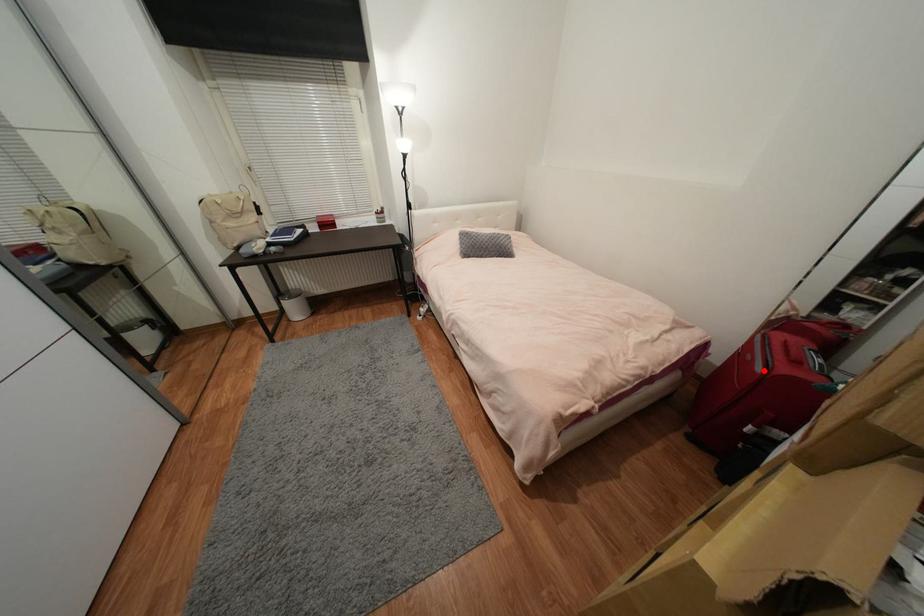
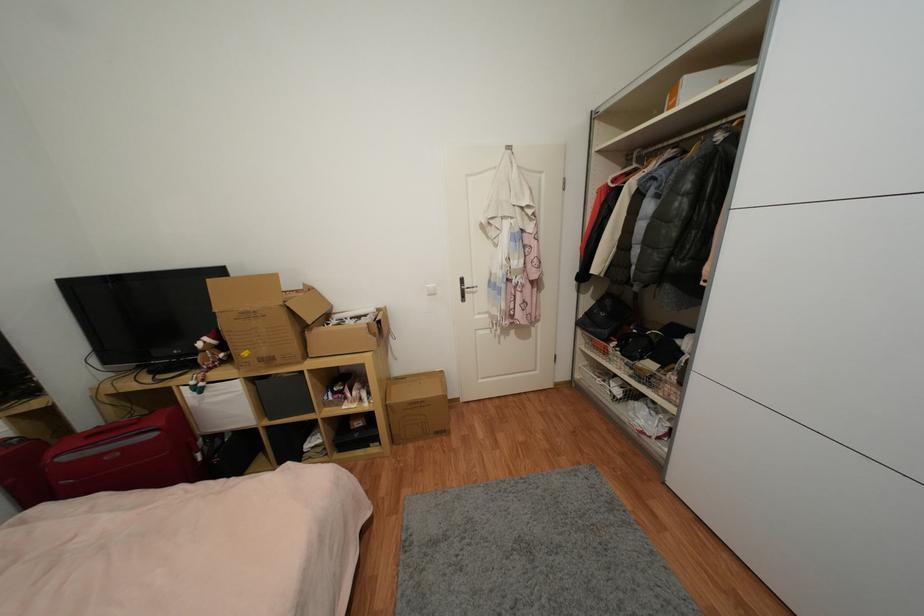
The point at the highlighted location is marked in the first image. Where is the corresponding point in the second image?

(157, 436)